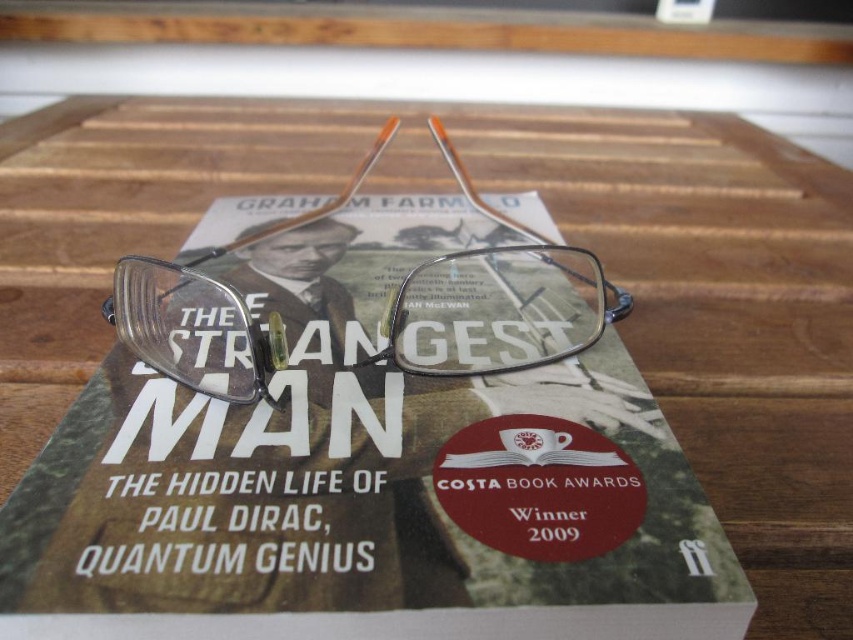
Question: Considering the relative positions of matte green book at center and clear plastic glasses at center in the image provided, where is matte green book at center located with respect to clear plastic glasses at center?

Choices:
 (A) right
 (B) left

Answer: (A)

Question: Is matte green book at center below clear plastic glasses at center?

Choices:
 (A) yes
 (B) no

Answer: (A)

Question: Which of the following is the farthest from the observer?

Choices:
 (A) (103, 461)
 (B) (196, 369)

Answer: (B)

Question: Which object appears closest to the camera in this image?

Choices:
 (A) clear plastic glasses at center
 (B) matte green book at center

Answer: (B)

Question: Does matte green book at center have a lesser width compared to clear plastic glasses at center?

Choices:
 (A) no
 (B) yes

Answer: (A)